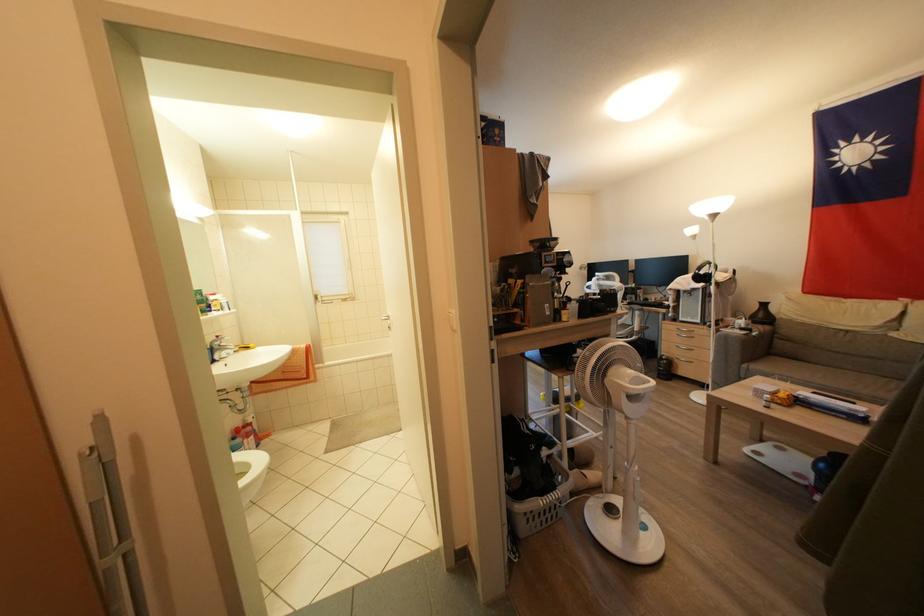
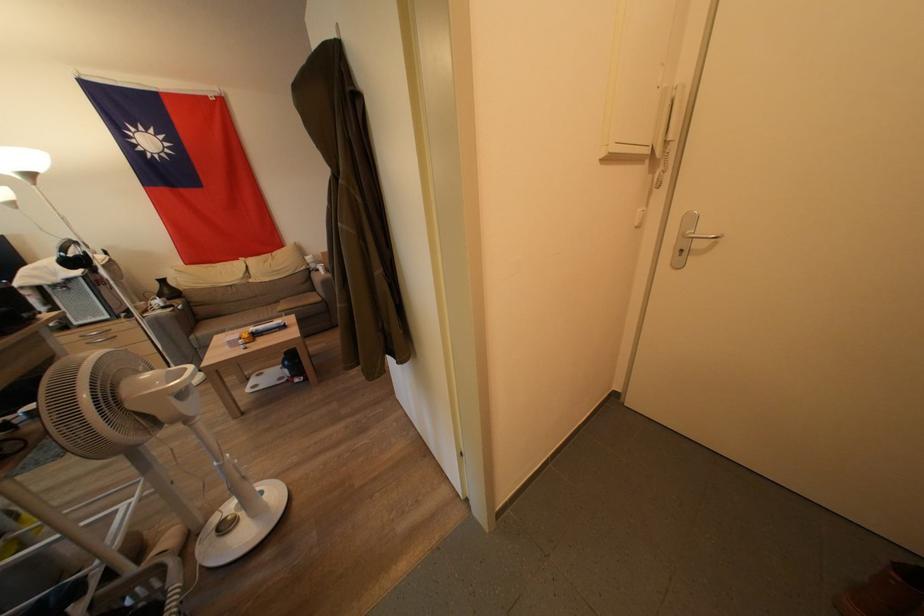
Based on the continuous images, in which direction is the camera rotating?

The camera's rotation is toward right-down.